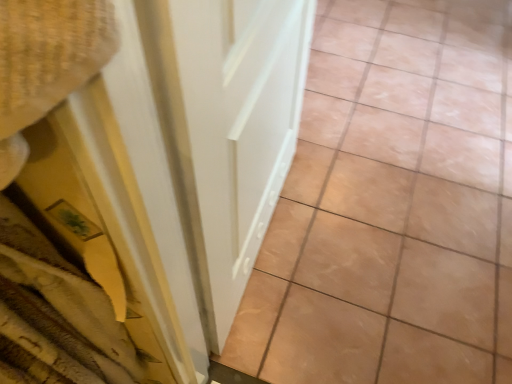
The image size is (512, 384). In order to click on free point in front of white glossy door at center in this screenshot , I will do `click(310, 320)`.